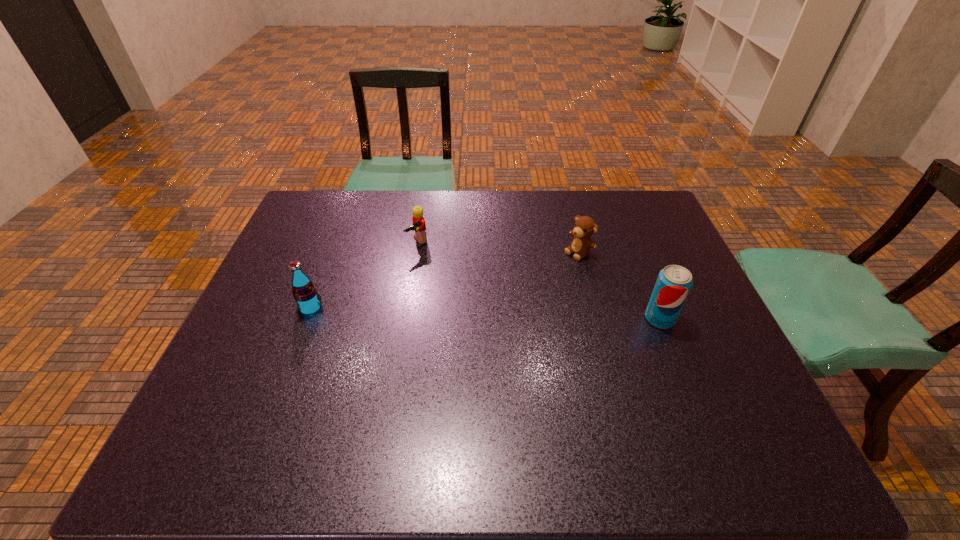
The image size is (960, 540). Find the location of `vacant area located in front of the second object from left to right with the accessory visible`. vacant area located in front of the second object from left to right with the accessory visible is located at coordinates (448, 279).

Locate an element on the screen. The width and height of the screenshot is (960, 540). free location located 0.050m in front of the second object from left to right with the accessory visible is located at coordinates (430, 260).

The width and height of the screenshot is (960, 540). Find the location of `object that is at the far edge`. object that is at the far edge is located at coordinates (418, 225).

Where is `object at the left edge`? The image size is (960, 540). object at the left edge is located at coordinates (304, 291).

Find the location of a particular element. This screenshot has width=960, height=540. object positioned at the right edge is located at coordinates (674, 282).

Where is `vacant space at the far edge`? This screenshot has width=960, height=540. vacant space at the far edge is located at coordinates (398, 215).

You are a GUI agent. You are given a task and a screenshot of the screen. Output one action in this format:
    pyautogui.click(x=<x>, y=<y>)
    Task: Click on the free point at the near edge
    The width and height of the screenshot is (960, 540).
    Given the screenshot: What is the action you would take?
    pyautogui.click(x=676, y=404)

Identify the location of free space at the left edge of the desktop. (278, 332).

Where is `free space at the right edge of the desktop`? This screenshot has height=540, width=960. free space at the right edge of the desktop is located at coordinates (714, 325).

In the image, there is a desktop. Identify the location of blank space at the far left corner. (311, 230).